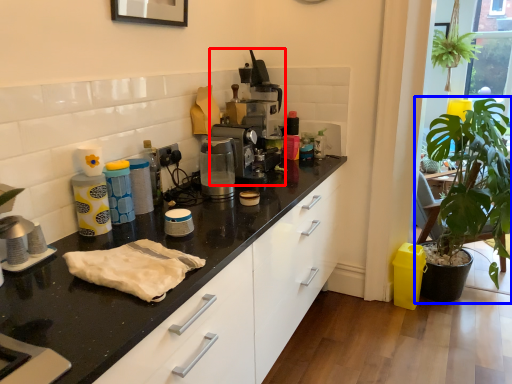
Question: Among these objects, which one is nearest to the camera, coffee machine (highlighted by a red box) or houseplant (highlighted by a blue box)?

Choices:
 (A) coffee machine
 (B) houseplant

Answer: (B)